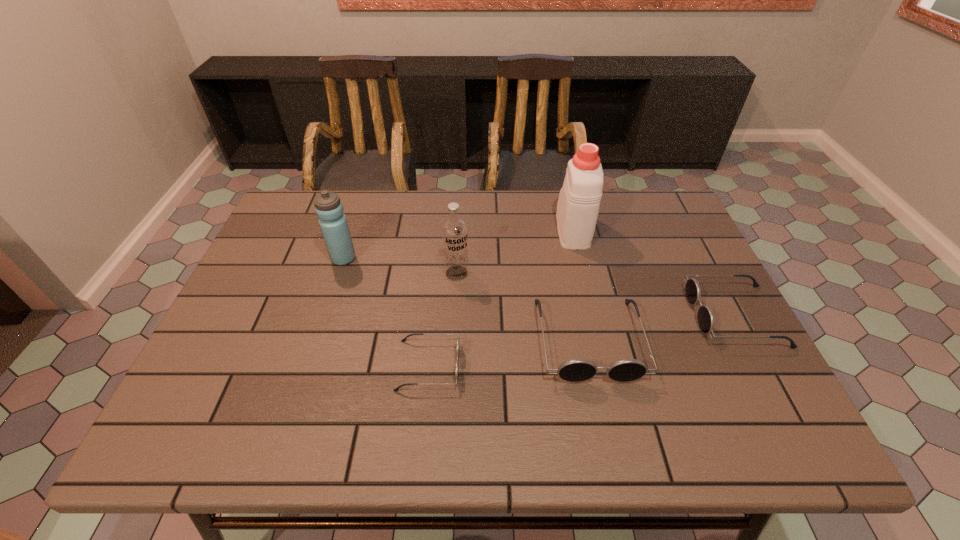
I want to click on vacant region located 0.060m on the front-facing side of the rightmost sunglasses, so click(668, 315).

At what (x,y) coordinates should I click in order to perform the action: click on blank space located 0.180m on the front-facing side of the rightmost sunglasses. Please return your answer as a coordinate pair (x, y). Looking at the image, I should click on (619, 315).

You are a GUI agent. You are given a task and a screenshot of the screen. Output one action in this format:
    pyautogui.click(x=<x>, y=<y>)
    Task: Click on the vacant space positioned 0.320m on the front-facing side of the rightmost sunglasses
    This screenshot has height=540, width=960.
    Given the screenshot: What is the action you would take?
    pyautogui.click(x=564, y=315)

Image resolution: width=960 pixels, height=540 pixels. I want to click on free space located 0.070m on the handle side of the tallest object, so point(565,198).

Where is `vacant area situated on the front of the water bottle`? This screenshot has width=960, height=540. vacant area situated on the front of the water bottle is located at coordinates (334, 288).

Locate an element on the screen. vacant space located 0.320m on the front label of the vodka is located at coordinates (450, 388).

I want to click on object at the far edge, so click(578, 205).

Locate an element on the screen. The height and width of the screenshot is (540, 960). object at the right edge is located at coordinates (706, 321).

The height and width of the screenshot is (540, 960). I want to click on free space at the far edge of the desktop, so click(497, 224).

Find the location of a particular element. This screenshot has width=960, height=540. vacant space at the near edge of the desktop is located at coordinates (463, 395).